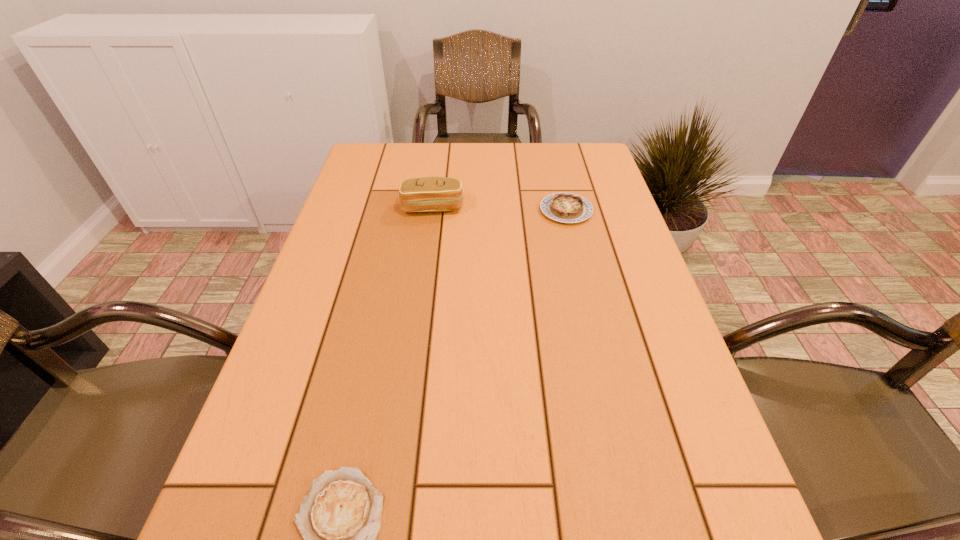
In the image, there is a desktop. Where is `vacant region at the far right corner`? The width and height of the screenshot is (960, 540). vacant region at the far right corner is located at coordinates (581, 150).

The width and height of the screenshot is (960, 540). Identify the location of free space between the second tallest object and the tallest object. (499, 209).

Identify which object is located as the nearest to the tallest object. Please provide its 2D coordinates. Your answer should be formatted as a tuple, i.e. [(x, y)], where the tuple contains the x and y coordinates of a point satisfying the conditions above.

[(564, 207)]

You are a GUI agent. You are given a task and a screenshot of the screen. Output one action in this format:
    pyautogui.click(x=<x>, y=<y>)
    Task: Click on the object that can be found as the closest to the clutch bag
    Image resolution: width=960 pixels, height=540 pixels.
    Given the screenshot: What is the action you would take?
    pyautogui.click(x=564, y=207)

The width and height of the screenshot is (960, 540). I want to click on vacant space that satisfies the following two spatial constraints: 1. on the zipper side of the clutch bag; 2. on the left side of the second shortest object, so click(433, 211).

This screenshot has height=540, width=960. I want to click on vacant space that satisfies the following two spatial constraints: 1. on the zipper side of the farther quiche; 2. on the left side of the tallest object, so click(x=433, y=211).